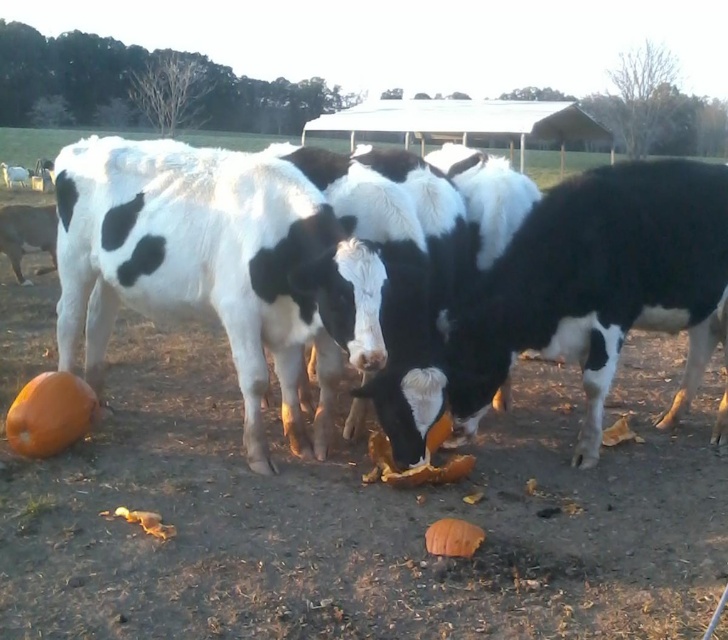
Question: Is black and white spotted cows at center smaller than orange matte pumpkin at lower center?

Choices:
 (A) yes
 (B) no

Answer: (B)

Question: Does orange matte pumpkin at lower left appear under orange matte pumpkin at lower center?

Choices:
 (A) no
 (B) yes

Answer: (A)

Question: Which point is closer to the camera taking this photo?

Choices:
 (A) (74, 401)
 (B) (628, 170)
 (C) (432, 522)

Answer: (C)

Question: Is black and white spotted cows at center thinner than orange matte pumpkin at lower center?

Choices:
 (A) yes
 (B) no

Answer: (B)

Question: Which object is farther from the camera taking this photo?

Choices:
 (A) black and white spotted cows at center
 (B) orange matte pumpkin at lower left
 (C) orange matte pumpkin at lower center

Answer: (A)

Question: Which point is farther to the camera?

Choices:
 (A) orange matte pumpkin at lower left
 (B) black and white spotted cows at center
 (C) orange matte pumpkin at lower center

Answer: (B)